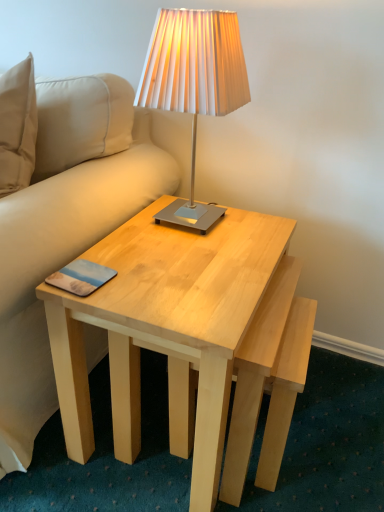
At what (x,y) coordinates should I click in order to perform the action: click on vacant area that is situated to the right of matte silver lamp at upper center. Please return your answer as a coordinate pair (x, y). This screenshot has height=512, width=384. Looking at the image, I should click on (257, 232).